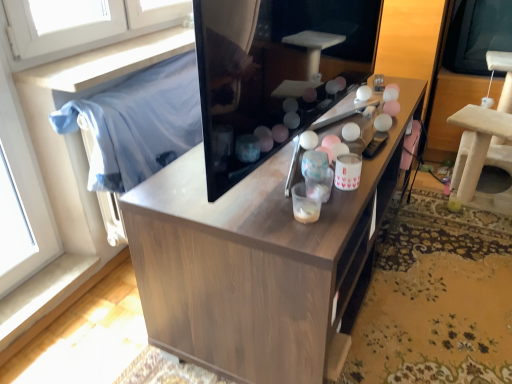
Find the location of `vacant space in front of beige carpeted cat tree at right`. vacant space in front of beige carpeted cat tree at right is located at coordinates (463, 258).